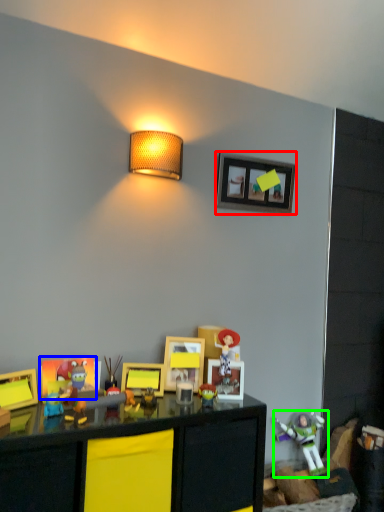
Question: Which object is the farthest from picture frame (highlighted by a red box)? Choose among these: picture frame (highlighted by a blue box) or toy (highlighted by a green box).

Choices:
 (A) picture frame
 (B) toy

Answer: (B)